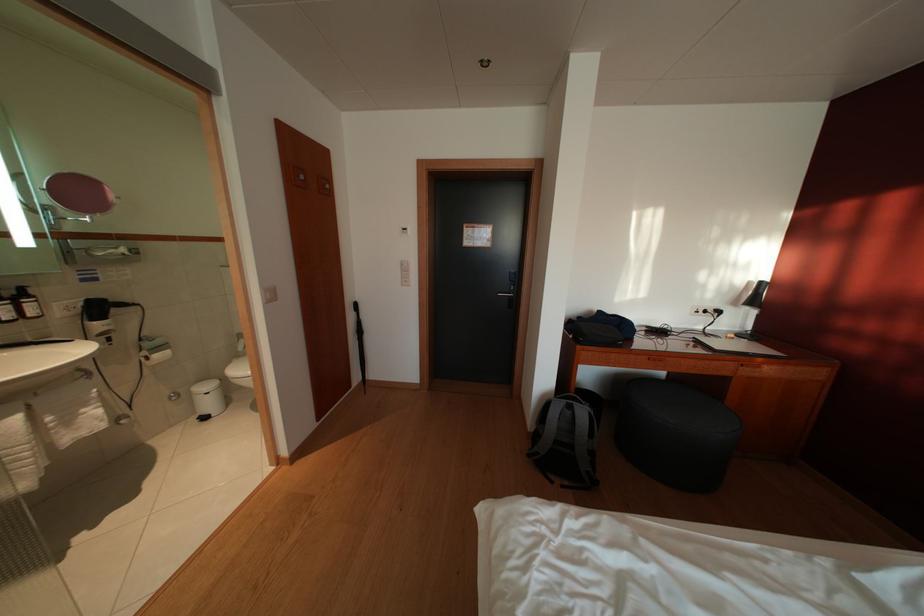
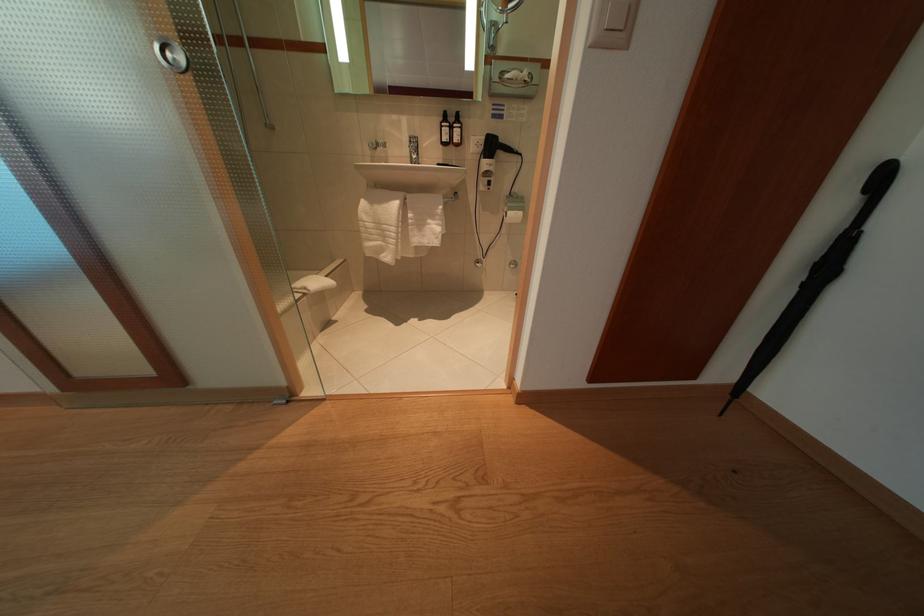
In the second image, find the point that corresponds to (x=164, y=362) in the first image.

(517, 219)